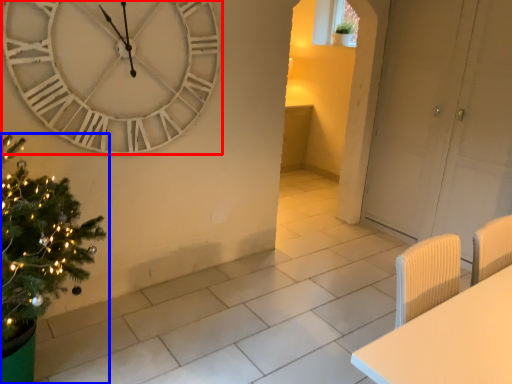
Question: Which of the following is the farthest to the observer, wall clock (highlighted by a red box) or christmas tree (highlighted by a blue box)?

Choices:
 (A) wall clock
 (B) christmas tree

Answer: (A)